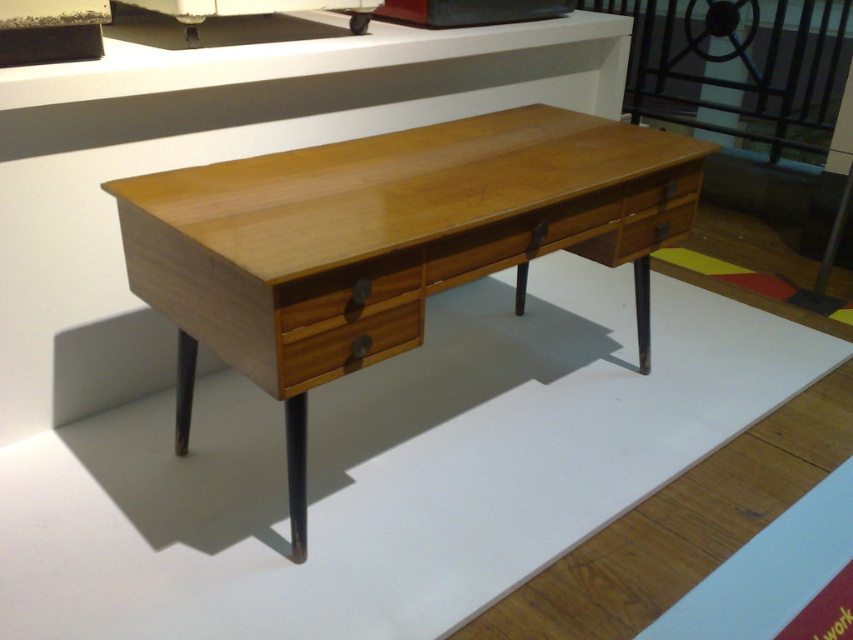
Can you confirm if light wood desk at center is positioned above wooden drawer at center?

Correct, light wood desk at center is located above wooden drawer at center.

Can you confirm if light wood desk at center is positioned to the right of wooden drawer at center?

Correct, you'll find light wood desk at center to the right of wooden drawer at center.

Which is behind, point (250, 362) or point (318, 285)?

The point (250, 362) is behind.

Where is `light wood desk at center`? This screenshot has height=640, width=853. light wood desk at center is located at coordinates (387, 243).